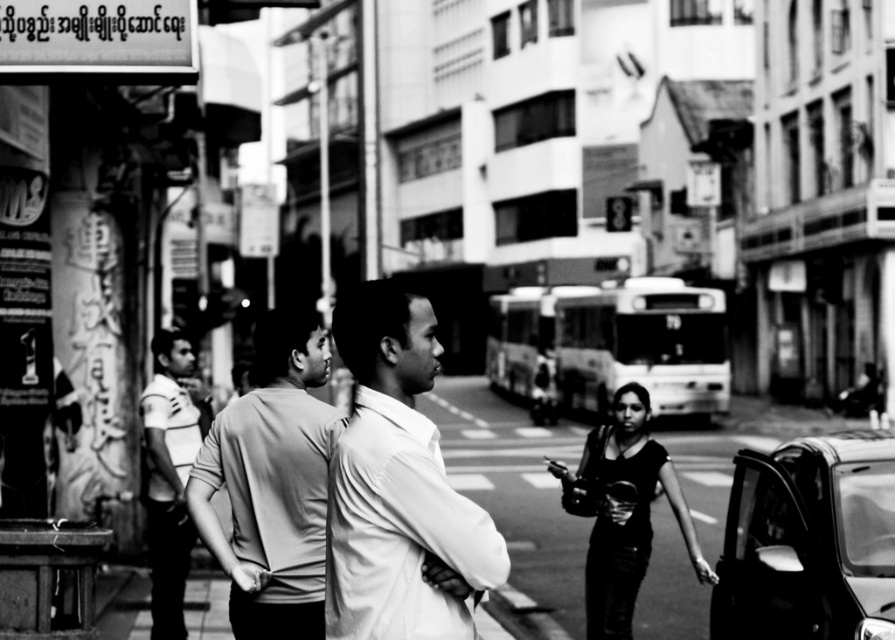
Question: From the image, what is the correct spatial relationship of white smooth shirt at center in relation to striped jersey at left?

Choices:
 (A) above
 (B) below

Answer: (A)

Question: Which point is farther to the camera?

Choices:
 (A) (883, 506)
 (B) (236, 401)
 (C) (175, 593)
 (D) (585, 609)

Answer: (D)

Question: Which object is closer to the camera taking this photo?

Choices:
 (A) metallic car door at lower right
 (B) white smooth shirt at center
 (C) matte black dress at center

Answer: (B)

Question: Among these points, which one is nearest to the camera?

Choices:
 (A) coord(644,465)
 (B) coord(296,522)

Answer: (B)

Question: Can you confirm if smooth gray t-shirt at center is positioned to the left of striped jersey at left?

Choices:
 (A) no
 (B) yes

Answer: (A)

Question: Is the position of metallic car door at lower right more distant than that of smooth gray t-shirt at center?

Choices:
 (A) no
 (B) yes

Answer: (B)